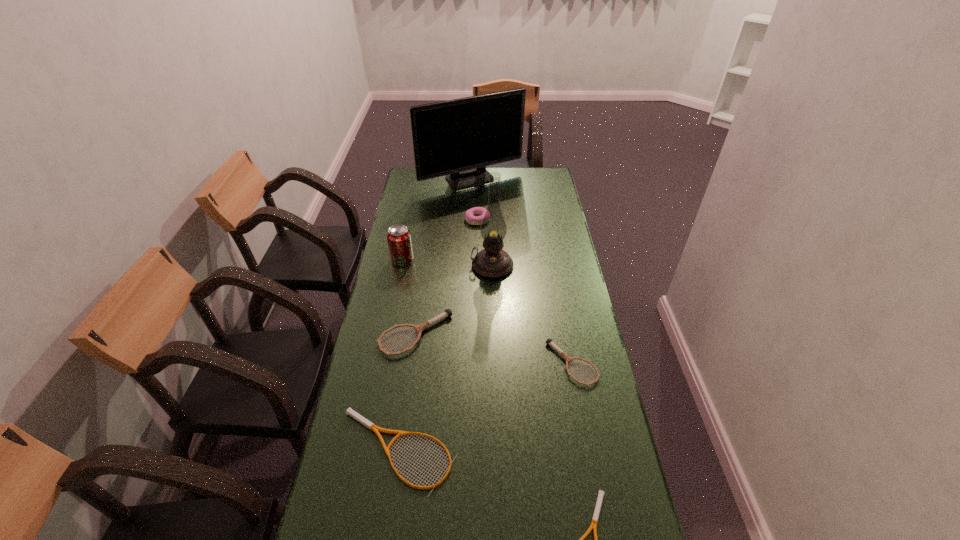
Locate an element on the screen. soda can that is positioned at the left edge is located at coordinates point(399,240).

Where is `computer monitor located at the right edge`? The image size is (960, 540). computer monitor located at the right edge is located at coordinates (458, 138).

Where is `tennis racket located at the right edge`? This screenshot has height=540, width=960. tennis racket located at the right edge is located at coordinates (549, 341).

I want to click on object present at the far left corner, so click(458, 138).

Image resolution: width=960 pixels, height=540 pixels. I want to click on object that is at the far right corner, so click(458, 138).

In the image, there is a desktop. Identify the location of free space at the left edge. This screenshot has height=540, width=960. (398, 400).

In the image, there is a desktop. At what (x,y) coordinates should I click in order to perform the action: click on vacant region at the right edge. Please return your answer as a coordinate pair (x, y). The width and height of the screenshot is (960, 540). Looking at the image, I should click on (540, 256).

The width and height of the screenshot is (960, 540). In the image, there is a desktop. What are the coordinates of `vacant space at the far left corner` in the screenshot? It's located at (433, 188).

Where is `free area in between the soda can and the smaller gray tennis racket`? free area in between the soda can and the smaller gray tennis racket is located at coordinates (488, 312).

Identify the location of unoccupied area between the computer monitor and the seventh nearest object. pyautogui.click(x=474, y=200).